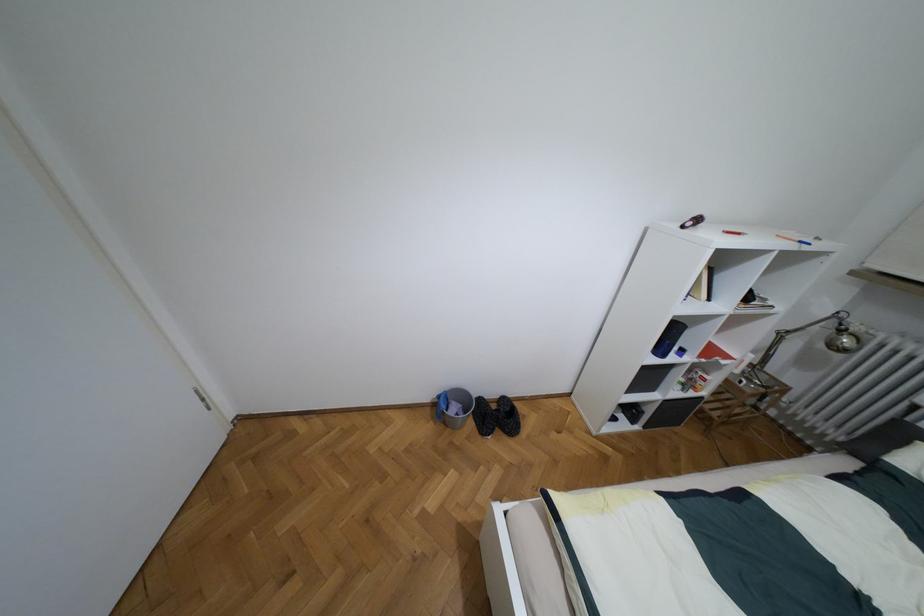
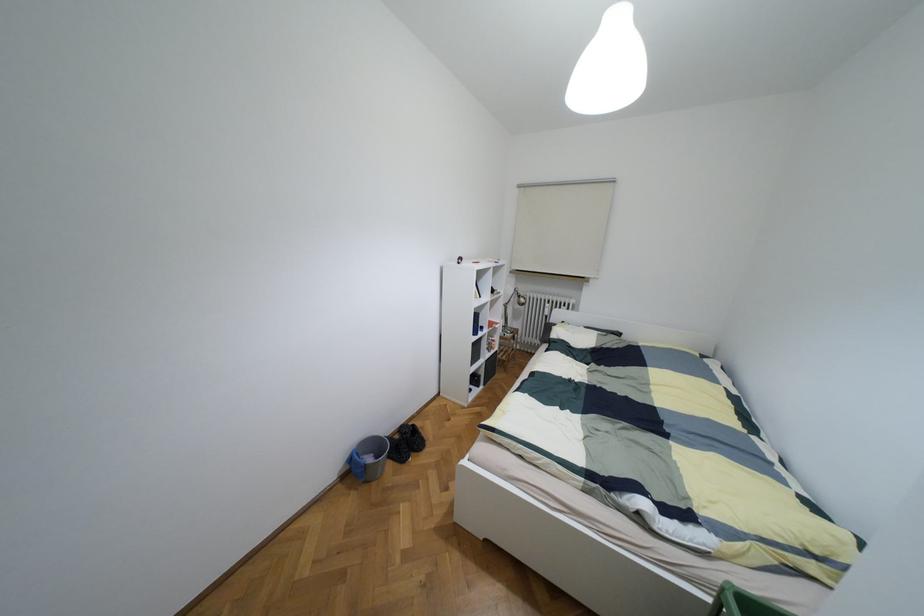
The point at (x=492, y=406) is marked in the first image. Where is the corresponding point in the second image?

(395, 436)